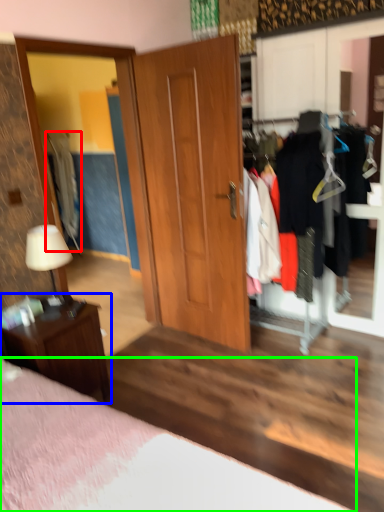
Question: Considering the real-world distances, which object is farthest from clothing (highlighted by a red box)? nightstand (highlighted by a blue box) or bed (highlighted by a green box)?

Choices:
 (A) nightstand
 (B) bed

Answer: (B)